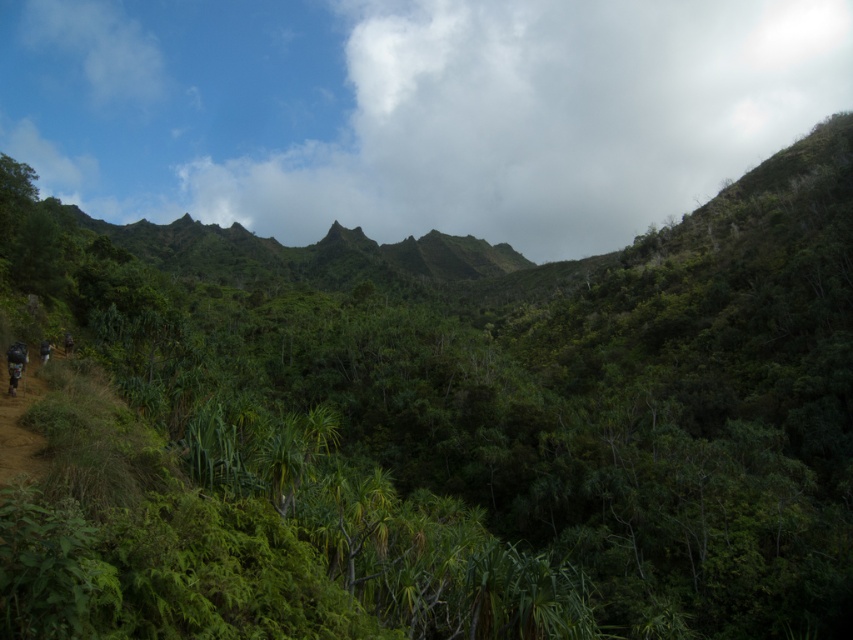
Question: Which point appears farthest from the camera in this image?

Choices:
 (A) (15, 369)
 (B) (778, 70)

Answer: (B)

Question: Which point is closer to the camera?

Choices:
 (A) cloudy sky at upper center
 (B) camouflage fabric mountain biker at lower left

Answer: (B)

Question: Can you confirm if cloudy sky at upper center is wider than camouflage fabric mountain biker at lower left?

Choices:
 (A) yes
 (B) no

Answer: (A)

Question: Can you confirm if cloudy sky at upper center is smaller than camouflage fabric mountain biker at lower left?

Choices:
 (A) yes
 (B) no

Answer: (B)

Question: Is cloudy sky at upper center behind camouflage fabric mountain biker at lower left?

Choices:
 (A) yes
 (B) no

Answer: (A)